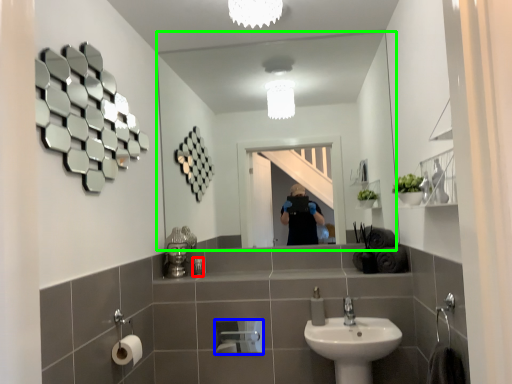
Question: Which object is positioned farthest from toiletry (highlighted by a red box)? Select from toilet paper (highlighted by a blue box) and mirror (highlighted by a green box).

Choices:
 (A) toilet paper
 (B) mirror

Answer: (B)